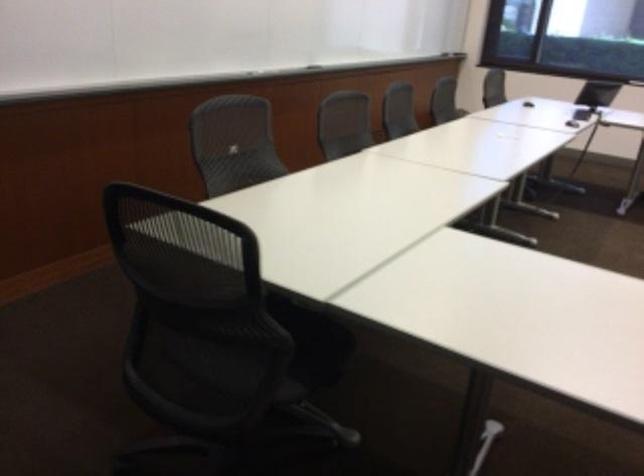
The width and height of the screenshot is (644, 476). Find the location of `black laptop computer`. black laptop computer is located at coordinates (x=597, y=93).